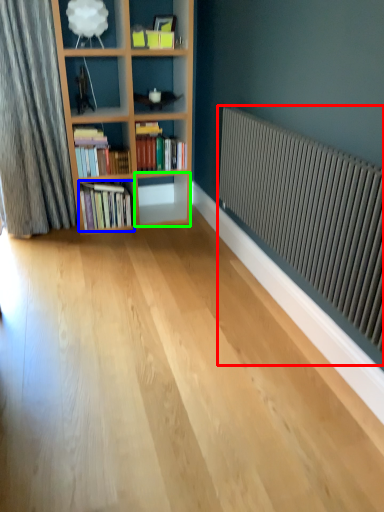
Question: Which is nearer to the radiator (highlighted by a red box)? book (highlighted by a blue box) or shelf (highlighted by a green box).

Choices:
 (A) book
 (B) shelf

Answer: (A)